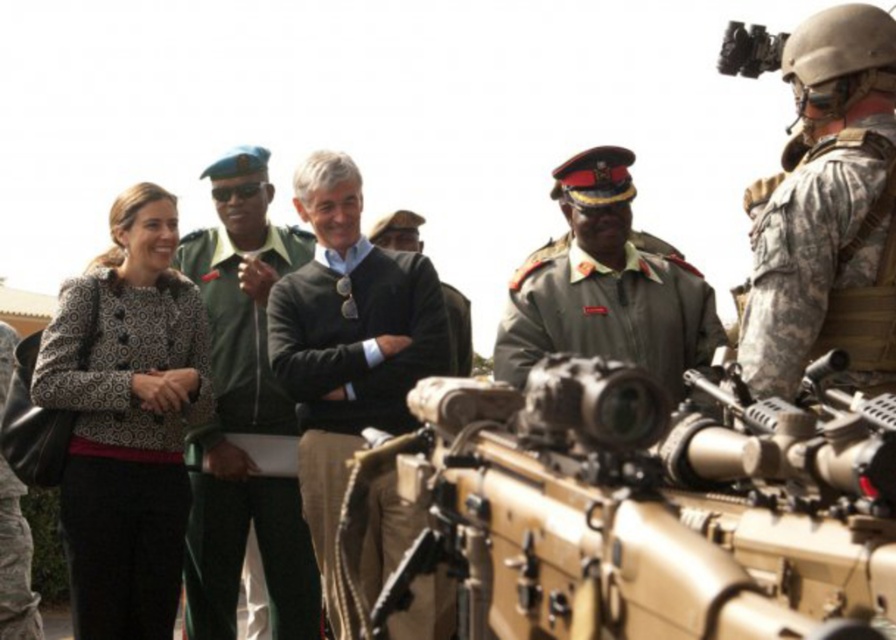
Which is in front, point (306, 458) or point (205, 540)?

Positioned in front is point (306, 458).

Based on the photo, is dark gray sweater at center behind green uniform at center?

No, dark gray sweater at center is in front of green uniform at center.

Is point (332, 545) positioned behind point (224, 586)?

That is False.

You are a GUI agent. You are given a task and a screenshot of the screen. Output one action in this format:
    pyautogui.click(x=<x>, y=<y>)
    Task: Click on the dark gray sweater at center
    The width and height of the screenshot is (896, 640).
    Given the screenshot: What is the action you would take?
    pyautogui.click(x=349, y=344)

Between camouflage uniform at right and green uniform at center, which one is positioned higher?

camouflage uniform at right is higher up.

Is camouflage uniform at right wider than green uniform at center?

No.

What do you see at coordinates (828, 212) in the screenshot?
I see `camouflage uniform at right` at bounding box center [828, 212].

Where is `camouflage uniform at right`? Image resolution: width=896 pixels, height=640 pixels. camouflage uniform at right is located at coordinates (828, 212).

Does camouflage uniform at right appear under dark gray sweater at center?

No.

Is camouflage uniform at right smaller than dark gray sweater at center?

Yes.

The height and width of the screenshot is (640, 896). In order to click on camouflage uniform at right in this screenshot , I will do `click(828, 212)`.